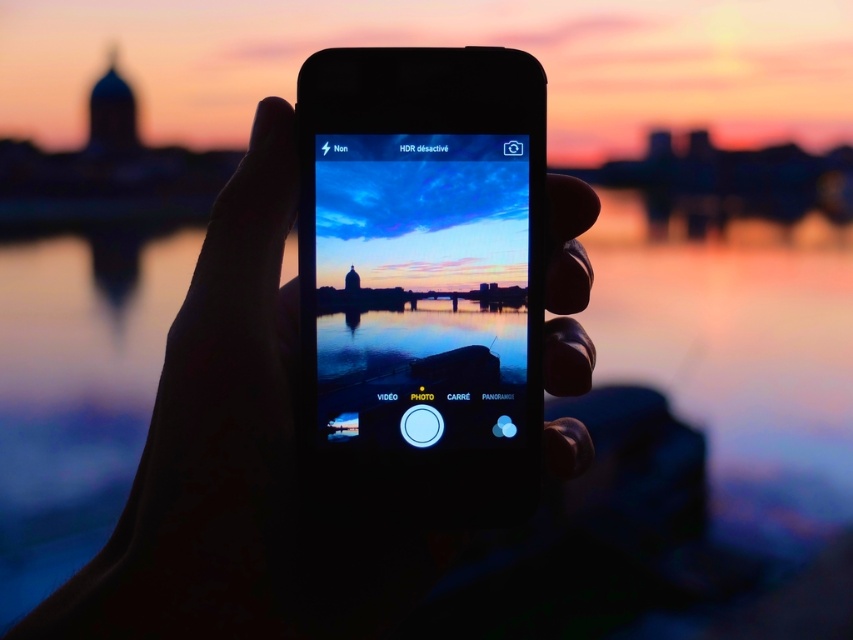
You are holding a matte black smartphone at center in your hand. You want to take a photo of the sunset in the background. The black matte hand at center is holding the phone. Can the phone fit entirely within the hand without overlapping the edges?

The matte black smartphone at center is narrower than the black matte hand at center, so yes, the phone can fit entirely within the hand without overlapping the edges.

Consider the image. You are holding a smartphone with a screen displaying a sunset photo. You want to place a sticker exactly at point (462,83) on the screen. If your hand is 50 centimeters away from that point, will you be able to accurately place the sticker without moving your hand?

The distance between point (462,83) and the viewer is 50.15 centimeters. Since your hand is 50 centimeters away, you are slightly closer than the required distance. You may need to adjust your hand position to match the exact 50.15 cm distance for accurate placement.